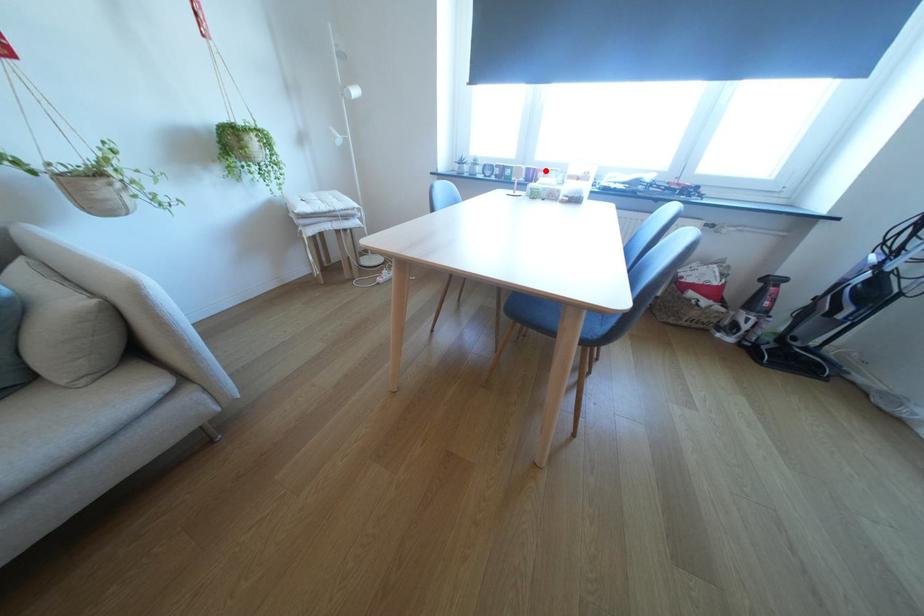
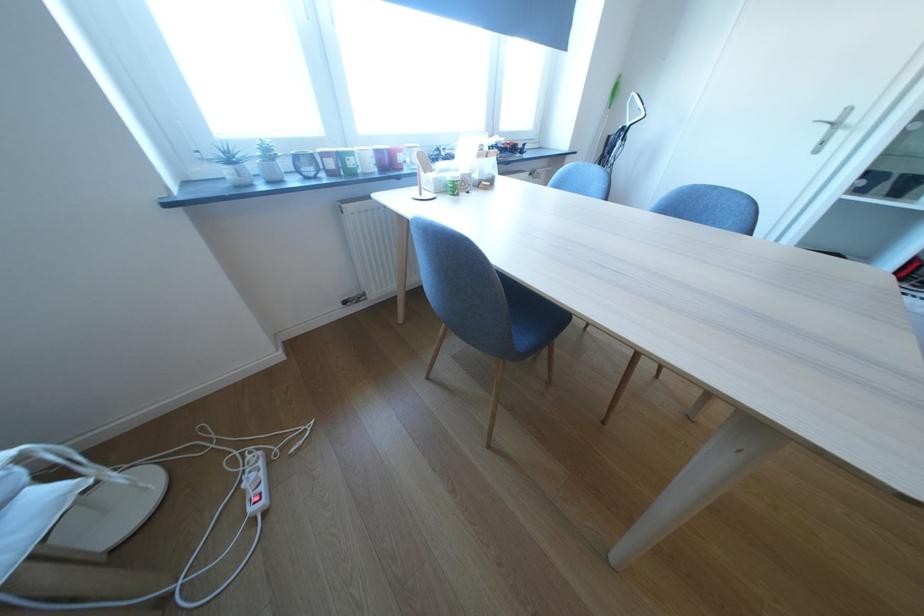
Locate, in the second image, the point that corresponds to the highlighted location in the first image.

(399, 151)